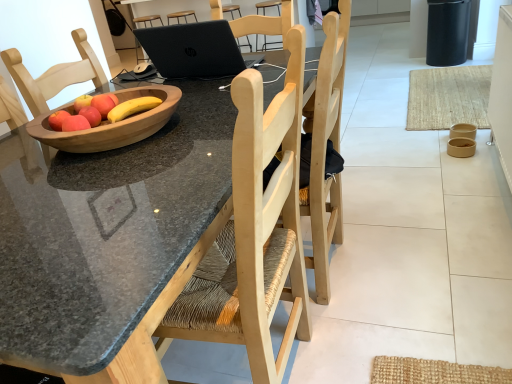
Find the location of a particular element. vacant position to the left of matte brown bowl at right, which ranks as the 1th bowl in back-to-front order is located at coordinates [x=432, y=140].